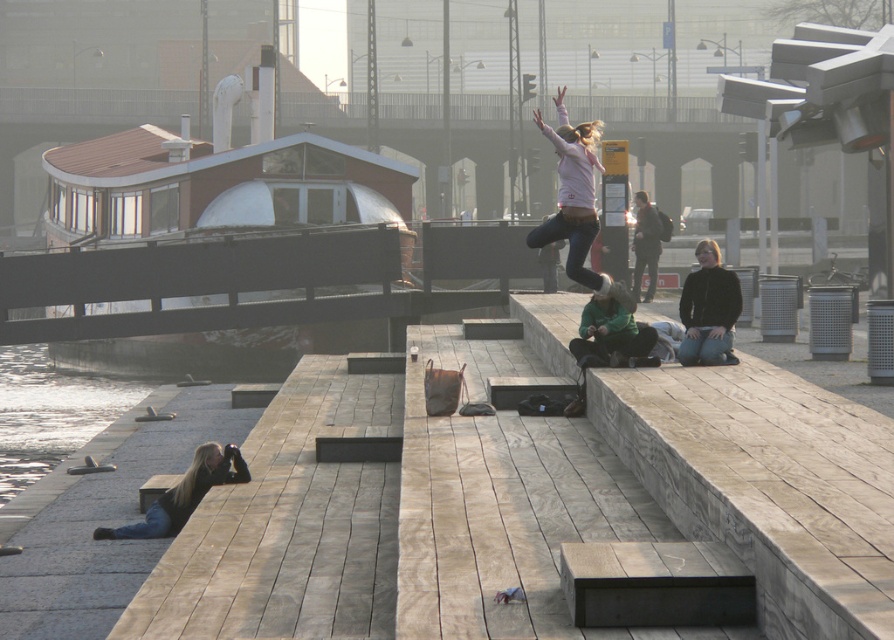
Is point (591, 154) less distant than point (696, 340)?

No, (591, 154) is behind (696, 340).

Which of these two, matte pink sweater at upper center or black leather jacket at center, stands shorter?

With less height is black leather jacket at center.

This screenshot has height=640, width=894. I want to click on matte pink sweater at upper center, so click(575, 200).

Where is `matte pink sweater at upper center`? The image size is (894, 640). matte pink sweater at upper center is located at coordinates (575, 200).

Which of these two, wooden bench at center or wooden dock at lower left, stands shorter?

wooden dock at lower left

Does wooden bench at center appear on the right side of wooden dock at lower left?

Correct, you'll find wooden bench at center to the right of wooden dock at lower left.

The image size is (894, 640). Describe the element at coordinates (766, 483) in the screenshot. I see `wooden bench at center` at that location.

Identify the location of wooden bench at center. (766, 483).

Is point (710, 339) positioned in front of point (651, 266)?

Yes, it is in front of point (651, 266).

Find the location of a particular element. This screenshot has width=894, height=640. black leather jacket at center is located at coordinates click(x=707, y=308).

Locate an element on the screen. The width and height of the screenshot is (894, 640). black leather jacket at center is located at coordinates (707, 308).